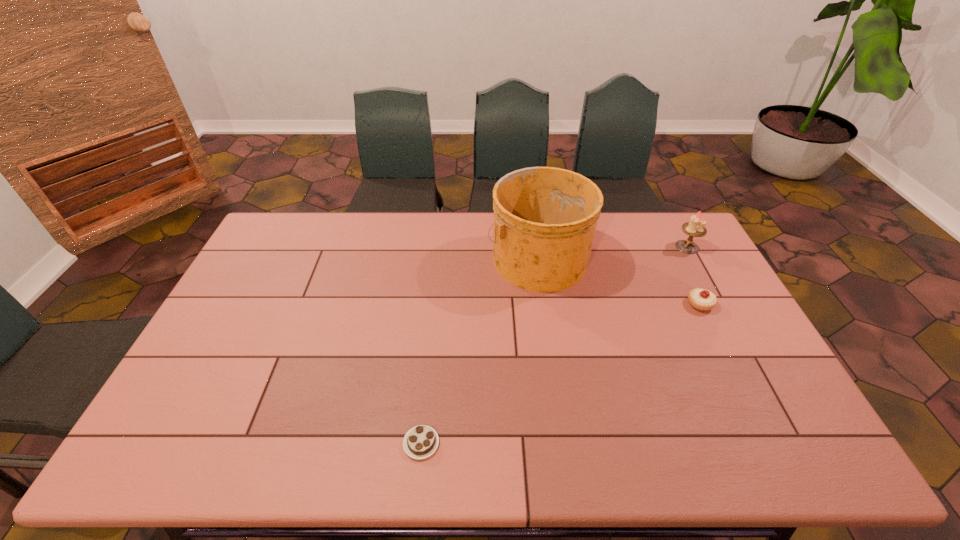
This screenshot has width=960, height=540. In order to click on blank space at the right edge of the desktop in this screenshot , I will do `click(719, 301)`.

The height and width of the screenshot is (540, 960). Identify the location of vacant area at the far left corner of the desktop. (292, 241).

Where is `blank area at the near left corner`? The image size is (960, 540). blank area at the near left corner is located at coordinates (147, 450).

Find the location of a particular element. Image resolution: width=960 pixels, height=540 pixels. vacant space at the far right corner of the desktop is located at coordinates (682, 238).

At what (x,y) coordinates should I click in order to perform the action: click on blank region between the second object from left to right and the chocolate cake. Please return your answer as a coordinate pair (x, y). The image size is (960, 540). Looking at the image, I should click on (480, 350).

Where is `free space between the candle holder and the third tallest object`? The image size is (960, 540). free space between the candle holder and the third tallest object is located at coordinates (694, 275).

Find the location of a particular element. This screenshot has height=540, width=960. free spot between the chocolate cake and the candle holder is located at coordinates (554, 345).

Locate an element on the screen. Image resolution: width=960 pixels, height=540 pixels. vacant point located between the chocolate cake and the candle holder is located at coordinates (554, 345).

Locate an element on the screen. This screenshot has height=540, width=960. free space between the second shortest object and the bucket is located at coordinates click(619, 281).

Where is `free point between the third shortest object and the leftmost object`? The height and width of the screenshot is (540, 960). free point between the third shortest object and the leftmost object is located at coordinates (554, 345).